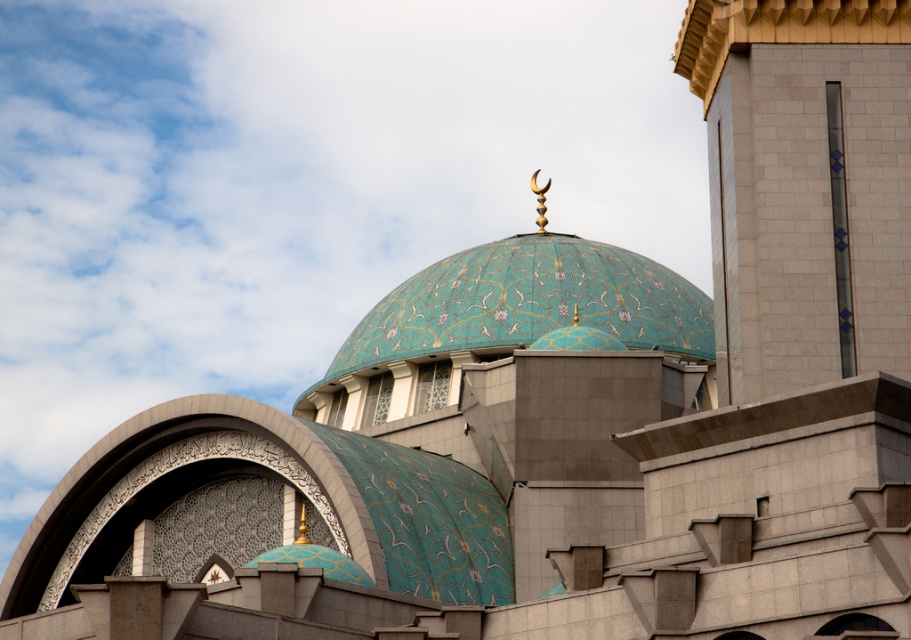
You are an architect designing a model of this mosque. You have to place the smooth beige tower at upper right and the teal mosaic dome at center. Which object should be placed first if you want to ensure proper scaling based on their sizes?

The teal mosaic dome at center should be placed first because it is larger than the smooth beige tower at upper right, ensuring proper scaling when positioning both elements.

You are standing in front of the mosque and want to take a photo that includes both the smooth beige tower at upper right and the teal mosaic dome at center. Which direction should you turn your camera to ensure both are in the frame?

You should turn your camera to the right to include both the smooth beige tower at upper right and the teal mosaic dome at center, as the smooth beige tower at upper right is located to the right of the teal mosaic dome at center.

Consider the image. You are an architect assessing the structural integrity of the building. Given the smooth beige tower at upper right and the teal mosaic dome at center, which one is more likely to require additional support due to its height?

The smooth beige tower at upper right is much taller than the teal mosaic dome at center, so it is more likely to require additional support due to its height.